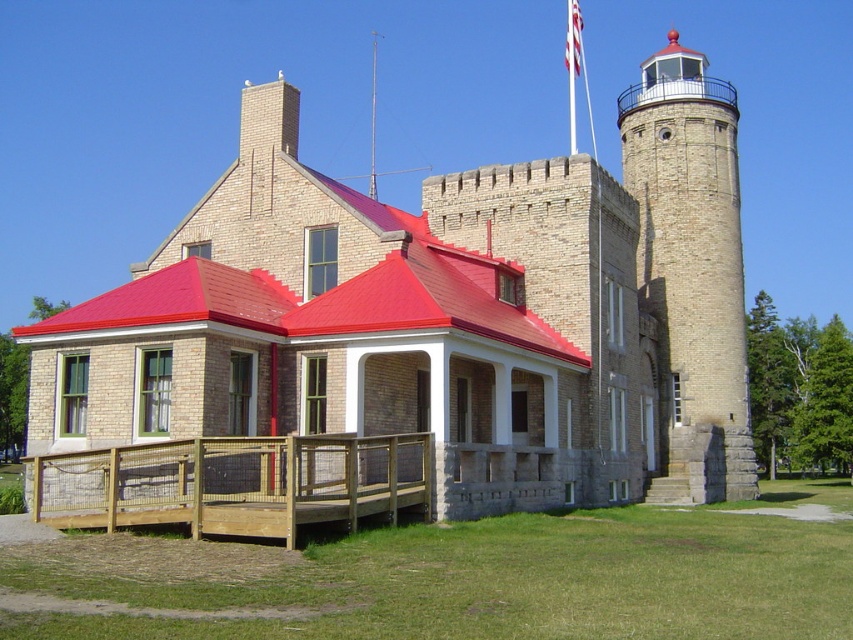
Question: Which point is farther to the camera?

Choices:
 (A) white fabric flag at upper center
 (B) stone lighthouse at upper right

Answer: (A)

Question: In this image, where is brick stone castle at center located relative to white fabric flag at upper center?

Choices:
 (A) right
 (B) left

Answer: (B)

Question: Does wooden deck at lower left appear under white fabric flag at upper center?

Choices:
 (A) no
 (B) yes

Answer: (B)

Question: Can you confirm if brick stone castle at center is positioned to the right of white fabric flag at upper center?

Choices:
 (A) no
 (B) yes

Answer: (A)

Question: Among these objects, which one is nearest to the camera?

Choices:
 (A) wooden deck at lower left
 (B) white fabric flag at upper center
 (C) stone lighthouse at upper right

Answer: (A)

Question: Among these objects, which one is farthest from the camera?

Choices:
 (A) white fabric flag at upper center
 (B) brick stone castle at center

Answer: (A)